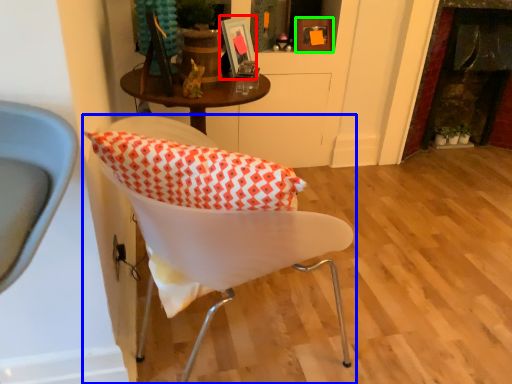
Question: Which is farther away from picture frame (highlighted by a red box)? chair (highlighted by a blue box) or picture frame (highlighted by a green box)?

Choices:
 (A) chair
 (B) picture frame

Answer: (A)